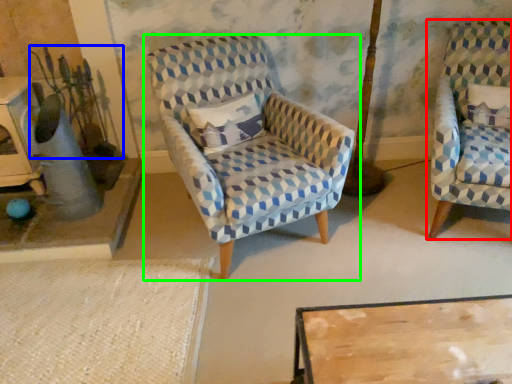
Question: Which object is the farthest from chair (highlighted by a red box)? Choose among these: plant (highlighted by a blue box) or chair (highlighted by a green box).

Choices:
 (A) plant
 (B) chair

Answer: (A)